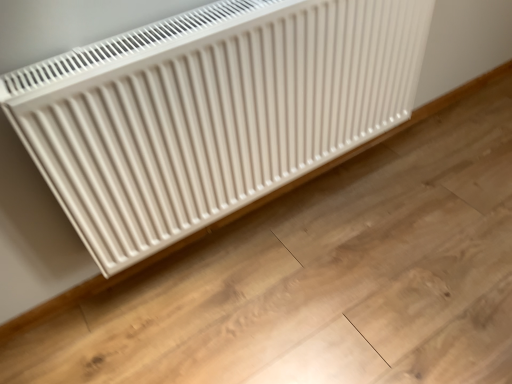
This screenshot has width=512, height=384. Identify the location of free spot below white matte radiator at center (from a real-world perspective). (317, 173).